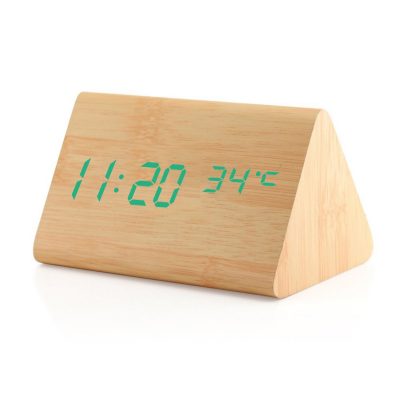
I want to click on clock, so click(x=227, y=238).